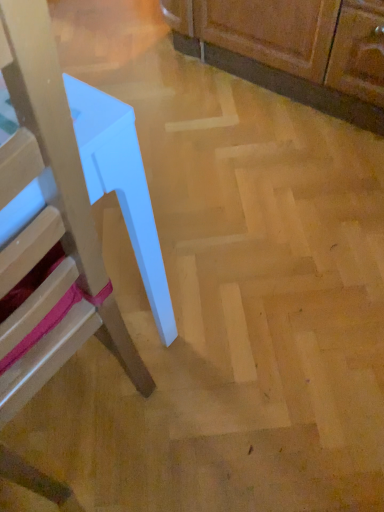
Where is `vacant space to the right of matte white chair at left`? This screenshot has height=512, width=384. vacant space to the right of matte white chair at left is located at coordinates (223, 374).